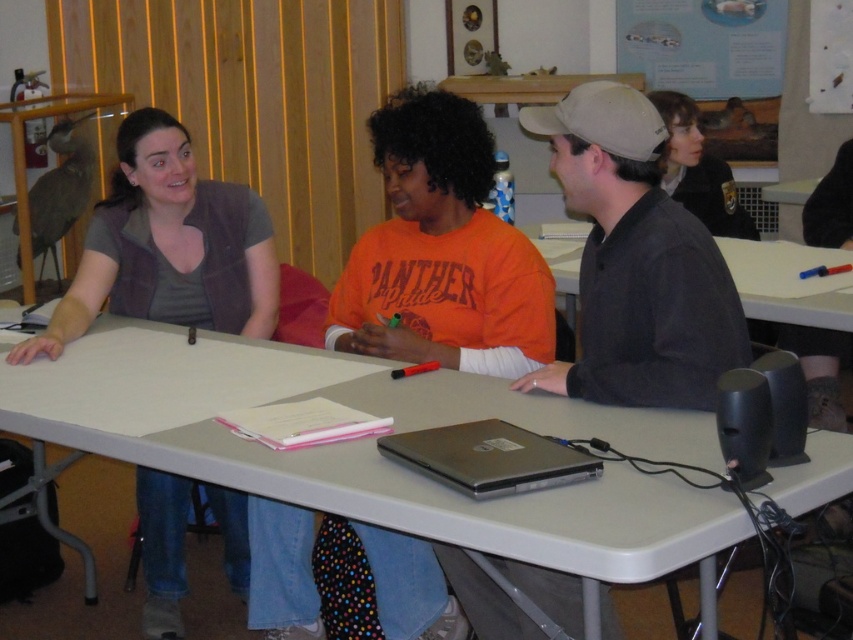
Where is the matte gray vest at left located in the image?

The matte gray vest at left is located at the coordinates point (167, 246).

You are sitting at the matte plastic table at center and want to hand a document to the person wearing the matte black jacket at upper right. In which direction should you move to reach them?

The matte plastic table at center is to the left of the matte black jacket at upper right, so you should move to your right to reach them.